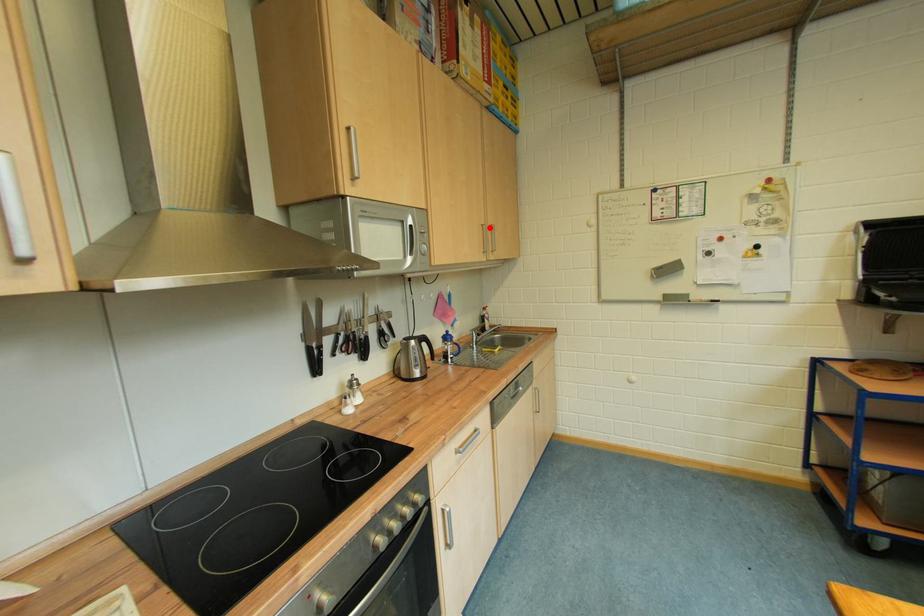
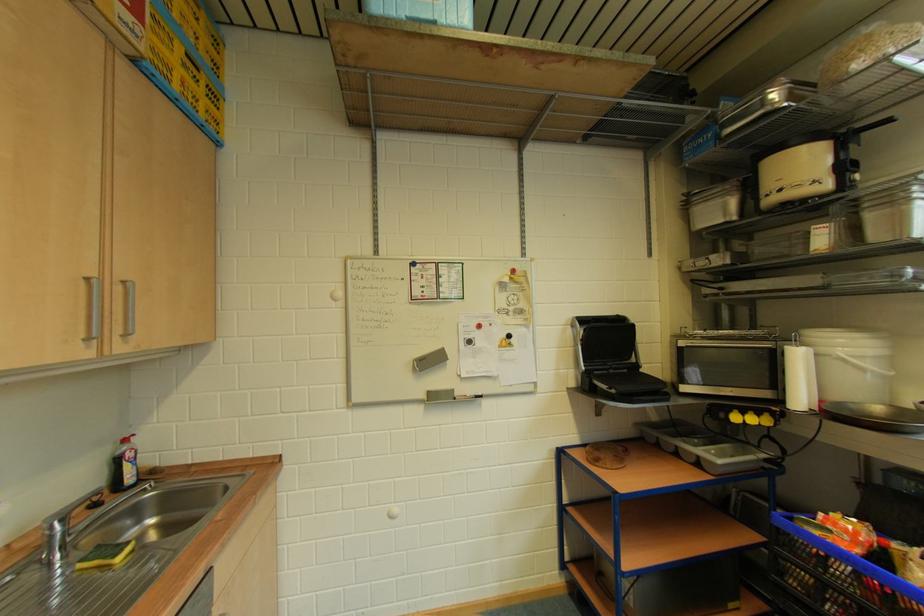
Locate, in the second image, the point that corresponds to the highlighted location in the first image.

(94, 282)